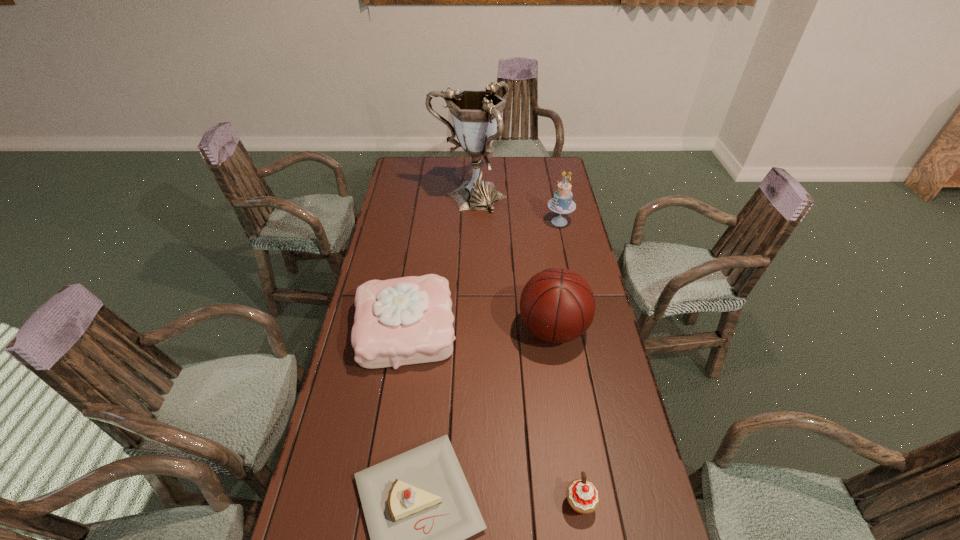
Select which object is the fourth closest to the fourth tallest object. Please provide its 2D coordinates. Your answer should be formatted as a tuple, i.e. [(x, y)], where the tuple contains the x and y coordinates of a point satisfying the conditions above.

[(582, 495)]

Image resolution: width=960 pixels, height=540 pixels. Identify the location of cake that is the second closest to the shortest cake. (562, 203).

Identify which cake is the second closest to the tallest cake. Please provide its 2D coordinates. Your answer should be formatted as a tuple, i.e. [(x, y)], where the tuple contains the x and y coordinates of a point satisfying the conditions above.

[(419, 509)]

This screenshot has width=960, height=540. Find the location of `free space that satisfies the following two spatial constraints: 1. on the front side of the basketball; 2. on the right side of the fifth tallest object`. free space that satisfies the following two spatial constraints: 1. on the front side of the basketball; 2. on the right side of the fifth tallest object is located at coordinates (580, 503).

The image size is (960, 540). I want to click on free spot that satisfies the following two spatial constraints: 1. on the front side of the fifth tallest object; 2. on the left side of the basketball, so click(580, 503).

Find the location of a particular element. free spot that satisfies the following two spatial constraints: 1. on the front side of the second shortest object; 2. on the left side of the fourth tallest object is located at coordinates (379, 503).

The image size is (960, 540). What are the coordinates of `free point that satisfies the following two spatial constraints: 1. on the front side of the cupcake; 2. on the right side of the second shortest cake` in the screenshot? It's located at (379, 503).